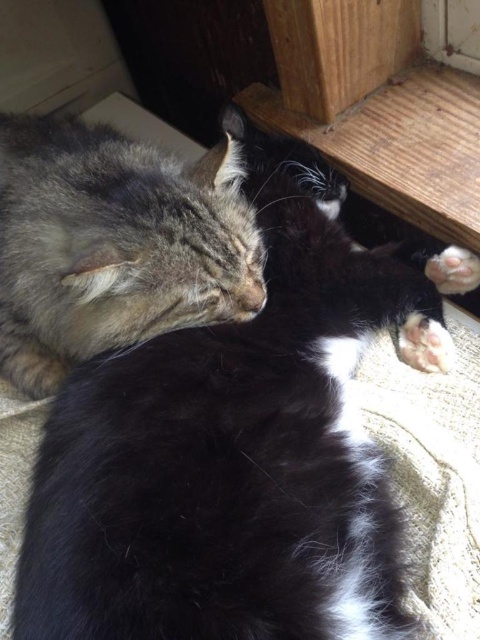
Question: Does gray fur cat at upper left come behind white soft paw at lower right?

Choices:
 (A) yes
 (B) no

Answer: (B)

Question: From the image, what is the correct spatial relationship of white soft paw at lower right in relation to white soft fur paw at lower right?

Choices:
 (A) right
 (B) left

Answer: (B)

Question: Is white soft paw at lower right positioned in front of white soft fur paw at lower right?

Choices:
 (A) yes
 (B) no

Answer: (A)

Question: Which point is closer to the camera?

Choices:
 (A) (149, 220)
 (B) (450, 248)
 (C) (447, 340)

Answer: (A)

Question: Among these objects, which one is farthest from the camera?

Choices:
 (A) white soft paw at lower right
 (B) gray fur cat at upper left

Answer: (A)

Question: Among these points, which one is farthest from the camera?

Choices:
 (A) (454, 358)
 (B) (425, 266)
 (C) (22, 320)

Answer: (B)